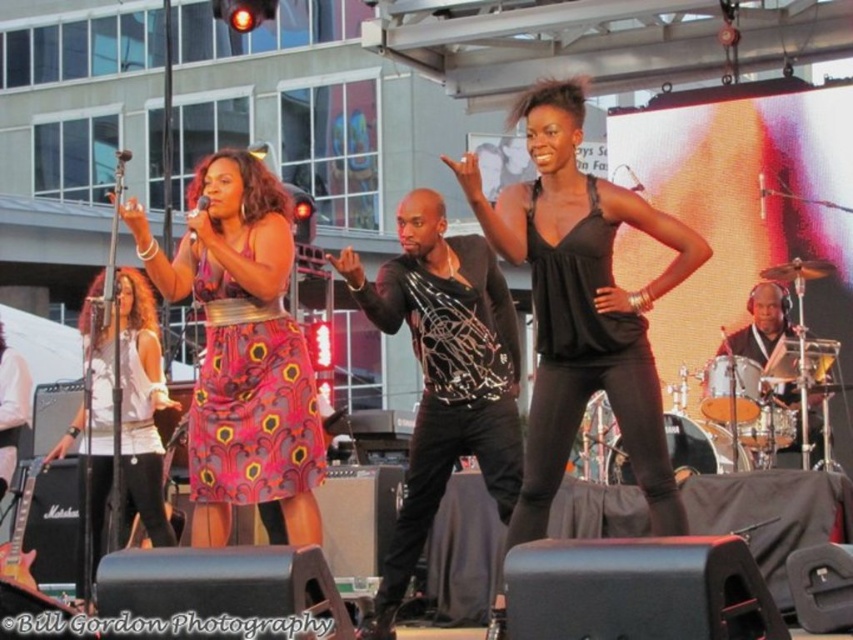
You are a photographer at the concert and want to capture both the pink printed dress at center and the pink floral dress at center in a single frame. Which dress should you focus on to ensure both are clearly visible?

The pink printed dress at center is larger in size compared to the pink floral dress at center, so focusing on the pink printed dress at center will help ensure both dresses are clearly visible in the frame.

You are a photographer at the concert and need to capture both the pink printed fabric dress at center and the pink floral dress at center in a single frame. Which dress should you focus on to ensure both are visible without zooming in too much?

The pink printed fabric dress at center is smaller than the pink floral dress at center, so focusing on the pink floral dress at center would allow both to be visible without excessive zooming.